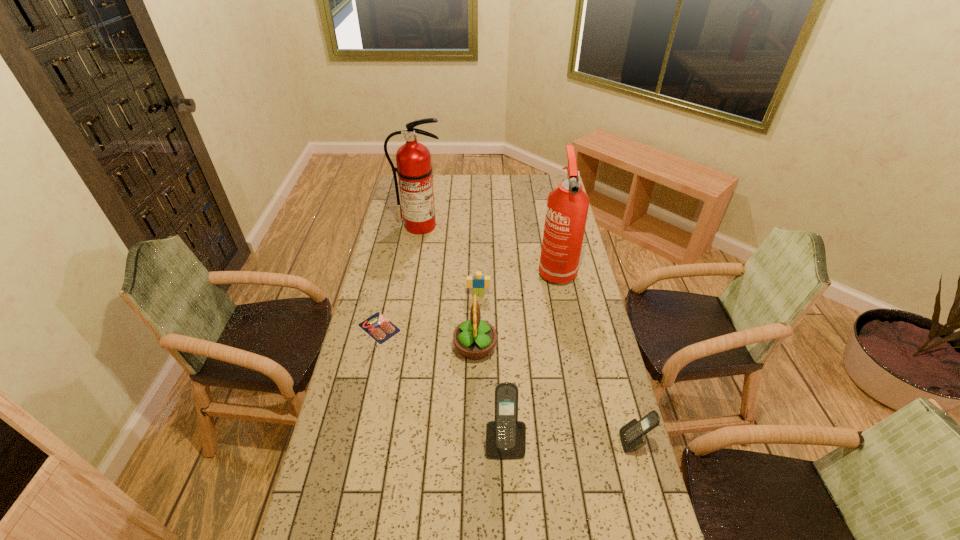
Find the location of a particular element. The width and height of the screenshot is (960, 540). vacant space in between the salami and the farthest object is located at coordinates (399, 276).

Identify the location of free space between the sunflower and the farther fire extinguisher. The height and width of the screenshot is (540, 960). (447, 287).

The width and height of the screenshot is (960, 540). What are the coordinates of `free space between the shorter cellular telephone and the sunflower` in the screenshot? It's located at (555, 395).

Identify the location of free space between the sunflower and the shortest object. (427, 338).

At what (x,y) coordinates should I click in order to perform the action: click on vacant space that's between the sunflower and the nearer fire extinguisher. Please return your answer as a coordinate pair (x, y). This screenshot has height=540, width=960. Looking at the image, I should click on (516, 308).

Find the location of a particular element. This screenshot has width=960, height=540. vacant region between the farther fire extinguisher and the rightmost object is located at coordinates (527, 334).

This screenshot has width=960, height=540. What are the coordinates of `free space between the second farthest object and the sunflower` in the screenshot? It's located at (516, 308).

Image resolution: width=960 pixels, height=540 pixels. What are the coordinates of `the third closest object to the sixth tallest object` in the screenshot? It's located at (377, 326).

Find the location of a particular element. The image size is (960, 540). the fourth closest object relative to the second shortest object is located at coordinates (414, 169).